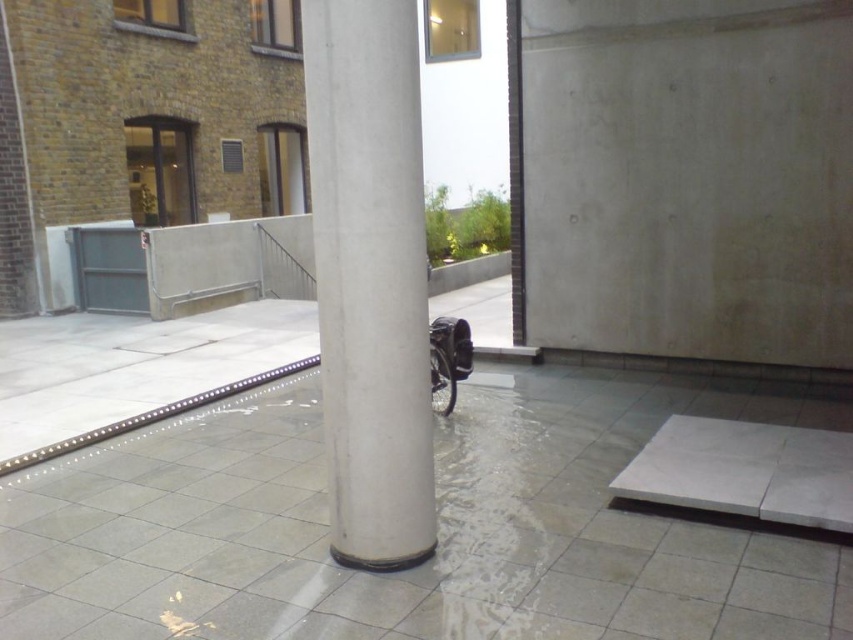
Question: Which object is closer to the camera taking this photo?

Choices:
 (A) white concrete ramp at lower right
 (B) white smooth concrete pillar at center

Answer: (B)

Question: Which object appears farthest from the camera in this image?

Choices:
 (A) white smooth concrete pillar at center
 (B) white concrete ramp at lower right

Answer: (B)

Question: Is white smooth concrete pillar at center above white concrete ramp at lower right?

Choices:
 (A) no
 (B) yes

Answer: (B)

Question: From the image, what is the correct spatial relationship of white smooth concrete pillar at center in relation to white concrete ramp at lower right?

Choices:
 (A) below
 (B) above

Answer: (B)

Question: Is white smooth concrete pillar at center below white concrete ramp at lower right?

Choices:
 (A) yes
 (B) no

Answer: (B)

Question: Among these points, which one is nearest to the camera?

Choices:
 (A) (367, 404)
 (B) (683, 416)

Answer: (A)